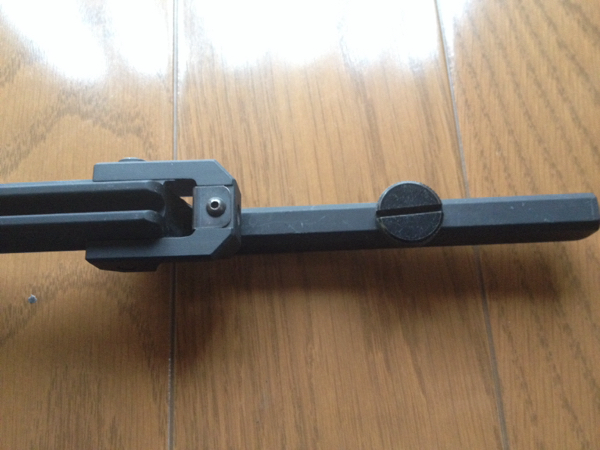
Where is `grout`? grout is located at coordinates (465, 153).